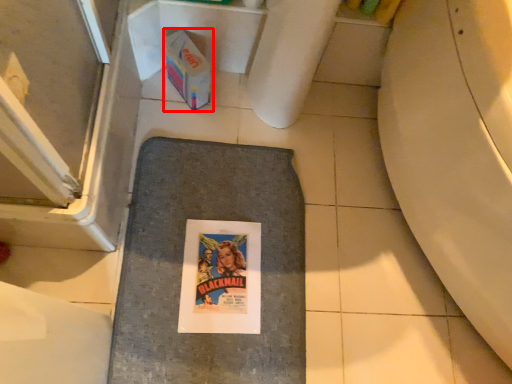
Question: Considering the relative positions of cardboard box (annotated by the red box) and bath mat in the image provided, where is cardboard box (annotated by the red box) located with respect to the staircase?

Choices:
 (A) right
 (B) left

Answer: (B)